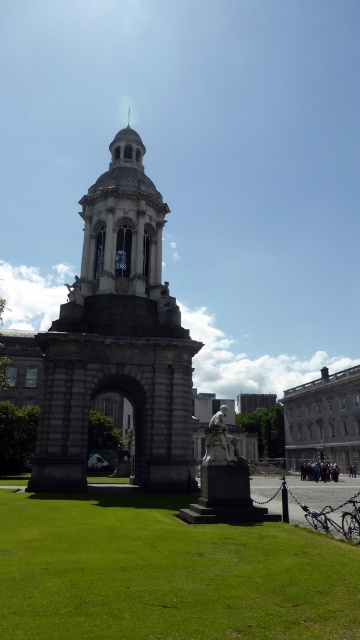
Question: Which object is positioned farthest from the white marble statue at center?

Choices:
 (A) white marble statue at lower center
 (B) green grass at center
 (C) gray stone tower at center

Answer: (C)

Question: Is the position of green grass at center more distant than that of white marble statue at center?

Choices:
 (A) yes
 (B) no

Answer: (B)

Question: Can you confirm if green grass at center is thinner than white marble statue at lower center?

Choices:
 (A) yes
 (B) no

Answer: (B)

Question: Can you confirm if green grass at center is thinner than gray stone tower at center?

Choices:
 (A) yes
 (B) no

Answer: (B)

Question: Which of the following is the farthest from the observer?

Choices:
 (A) gray stone tower at center
 (B) white marble statue at lower center
 (C) white marble statue at center
 (D) green grass at center

Answer: (A)

Question: Which point appears closest to the camera in this image?

Choices:
 (A) (228, 436)
 (B) (7, 602)
 (C) (30, 486)
 (D) (222, 440)

Answer: (B)